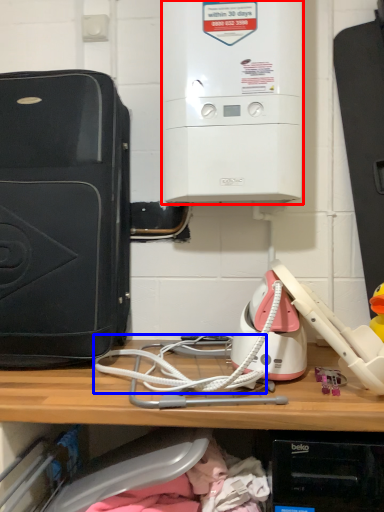
Question: Which of the following is the closest to the observer, home appliance (highlighted by a red box) or wire (highlighted by a blue box)?

Choices:
 (A) home appliance
 (B) wire

Answer: (B)